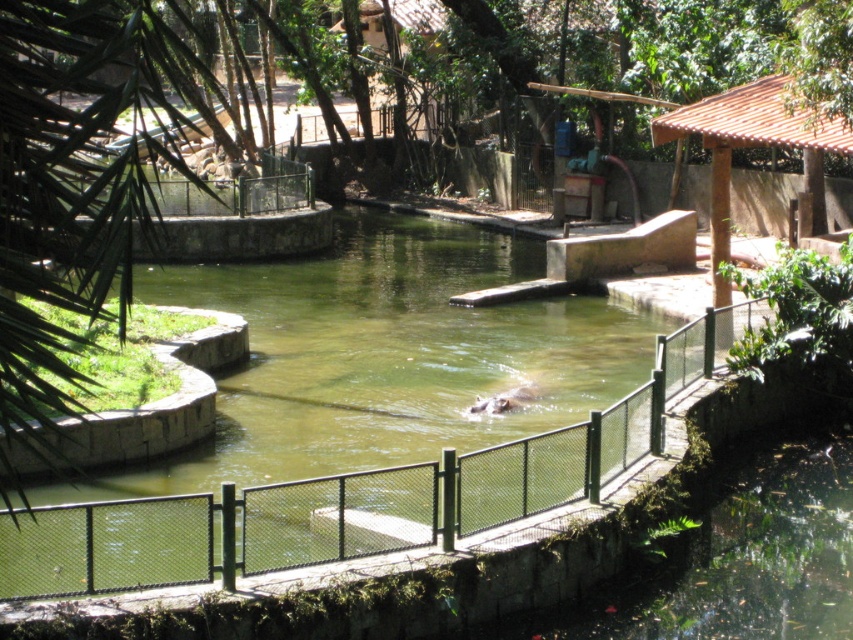
Between point (167, 529) and point (714, 289), which one is positioned in front?

Point (167, 529) is in front.

Which of these two, green mesh fence at center or brown tiled roof at upper right, stands taller?

With more height is green mesh fence at center.

This screenshot has height=640, width=853. What do you see at coordinates (218, 532) in the screenshot?
I see `green mesh fence at center` at bounding box center [218, 532].

Locate an element on the screen. green mesh fence at center is located at coordinates (218, 532).

Based on the photo, is brown tiled roof at upper right to the left of gray matte hippo at center from the viewer's perspective?

Incorrect, brown tiled roof at upper right is not on the left side of gray matte hippo at center.

Is brown tiled roof at upper right wider than gray matte hippo at center?

Indeed, brown tiled roof at upper right has a greater width compared to gray matte hippo at center.

Between point (728, 134) and point (511, 400), which one is positioned in front?

Point (511, 400)

What are the coordinates of `brown tiled roof at upper right` in the screenshot? It's located at [x=741, y=145].

Can you confirm if green mesh fence at center is thinner than gray matte hippo at center?

In fact, green mesh fence at center might be wider than gray matte hippo at center.

Is green mesh fence at center taller than gray matte hippo at center?

Indeed, green mesh fence at center has a greater height compared to gray matte hippo at center.

Identify the location of green mesh fence at center. The width and height of the screenshot is (853, 640). (218, 532).